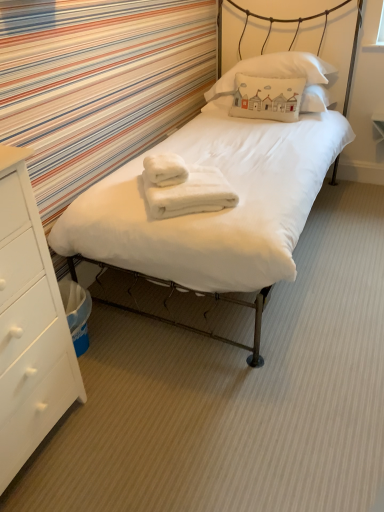
Question: Considering the relative positions of white wood chest of drawers at lower left and white soft towel at center, the first bath towel in the right-to-left sequence, in the image provided, is white wood chest of drawers at lower left in front of white soft towel at center, the first bath towel in the right-to-left sequence,?

Choices:
 (A) no
 (B) yes

Answer: (B)

Question: From the image's perspective, is white wood chest of drawers at lower left below white soft towel at center, positioned as the 2th bath towel in left-to-right order?

Choices:
 (A) no
 (B) yes

Answer: (B)

Question: Does white wood chest of drawers at lower left lie behind white soft towel at center, the first bath towel in the right-to-left sequence?

Choices:
 (A) yes
 (B) no

Answer: (B)

Question: Would you say white wood chest of drawers at lower left is a long distance from white soft towel at center, positioned as the 2th bath towel in left-to-right order?

Choices:
 (A) no
 (B) yes

Answer: (A)

Question: Is white wood chest of drawers at lower left outside white soft towel at center, the first bath towel in the right-to-left sequence?

Choices:
 (A) no
 (B) yes

Answer: (B)

Question: Considering their positions, is white matte bed at center located in front of or behind white wood chest of drawers at lower left?

Choices:
 (A) behind
 (B) front

Answer: (A)

Question: Which is correct: white matte bed at center is inside white wood chest of drawers at lower left, or outside of it?

Choices:
 (A) outside
 (B) inside

Answer: (A)

Question: From a real-world perspective, is white matte bed at center physically located above or below white wood chest of drawers at lower left?

Choices:
 (A) below
 (B) above

Answer: (B)

Question: Based on their sizes in the image, would you say white matte bed at center is bigger or smaller than white wood chest of drawers at lower left?

Choices:
 (A) small
 (B) big

Answer: (B)

Question: Looking at the image, does white soft towel at center, which appears as the 2th bath towel when viewed from the right, seem bigger or smaller compared to white matte bed at center?

Choices:
 (A) small
 (B) big

Answer: (A)

Question: In terms of width, does white soft towel at center, which appears as the 2th bath towel when viewed from the right, look wider or thinner when compared to white matte bed at center?

Choices:
 (A) thin
 (B) wide

Answer: (A)

Question: Considering the positions of white soft towel at center, which appears as the 2th bath towel when viewed from the right, and white matte bed at center in the image, is white soft towel at center, which appears as the 2th bath towel when viewed from the right, taller or shorter than white matte bed at center?

Choices:
 (A) short
 (B) tall

Answer: (A)

Question: In the image, is white soft towel at center, which ranks as the 1th bath towel in left-to-right order, positioned in front of or behind white matte bed at center?

Choices:
 (A) behind
 (B) front

Answer: (A)

Question: From their relative heights in the image, would you say white wood chest of drawers at lower left is taller or shorter than white soft towel at center, positioned as the 2th bath towel in left-to-right order?

Choices:
 (A) short
 (B) tall

Answer: (B)

Question: From a real-world perspective, is white wood chest of drawers at lower left physically located above or below white soft towel at center, the first bath towel in the right-to-left sequence?

Choices:
 (A) above
 (B) below

Answer: (B)